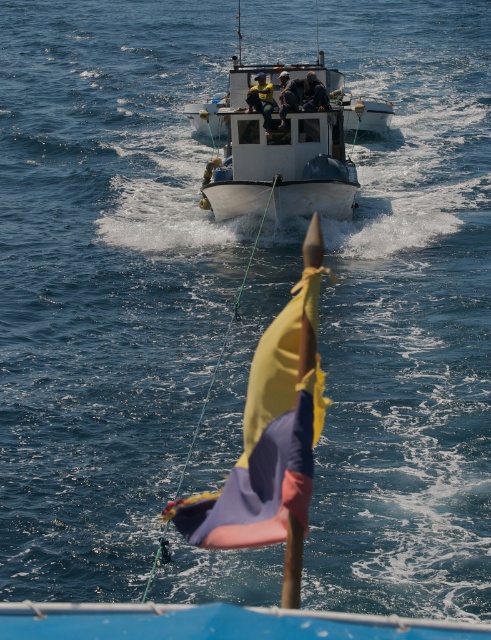
Based on the photo, does yellow fabric flag at center have a larger size compared to white matte boat at center?

Incorrect, yellow fabric flag at center is not larger than white matte boat at center.

Is point (287, 376) closer to camera compared to point (222, 220)?

Yes, point (287, 376) is in front of point (222, 220).

Identify the location of yellow fabric flag at center. (271, 429).

Identify the location of yellow fabric flag at center. (271, 429).

Who is higher up, yellow fabric flag at center or dark blue fabric jacket at center?

dark blue fabric jacket at center is above.

Does yellow fabric flag at center have a smaller size compared to dark blue fabric jacket at center?

Incorrect, yellow fabric flag at center is not smaller in size than dark blue fabric jacket at center.

Measure the distance between yellow fabric flag at center and camera.

yellow fabric flag at center and camera are 10.35 meters apart.

This screenshot has width=491, height=640. Identify the location of yellow fabric flag at center. (271, 429).

Which is below, yellow fabric jacket at center or dark blue fabric jacket at center?

Positioned lower is yellow fabric jacket at center.

The width and height of the screenshot is (491, 640). What are the coordinates of `yellow fabric jacket at center` in the screenshot? It's located at (262, 99).